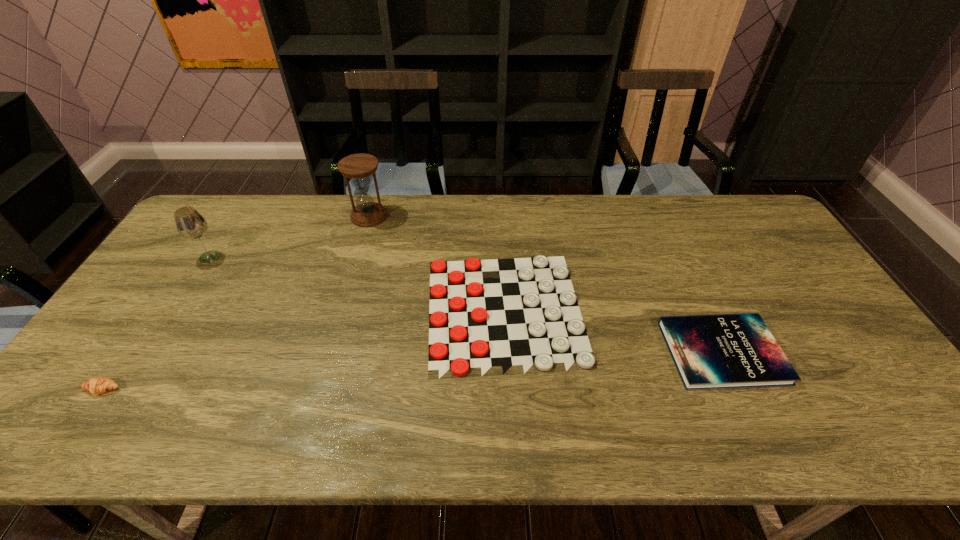
The height and width of the screenshot is (540, 960). In order to click on blank space that satisfies the following two spatial constraints: 1. on the front side of the second object from right to left; 2. on the left side of the hardback book in this screenshot , I will do `click(507, 353)`.

I want to click on free space that satisfies the following two spatial constraints: 1. on the front side of the fourth tallest object; 2. on the left side of the wineglass, so click(x=149, y=353).

The image size is (960, 540). Identify the location of vacant space that satisfies the following two spatial constraints: 1. on the front side of the second shortest object; 2. on the right side of the hourglass. (329, 353).